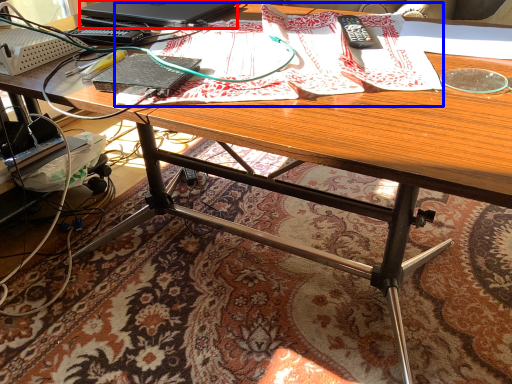
Question: Which object appears farthest to the camera in this image, laptop (highlighted by a red box) or wrapping paper (highlighted by a blue box)?

Choices:
 (A) laptop
 (B) wrapping paper

Answer: (A)